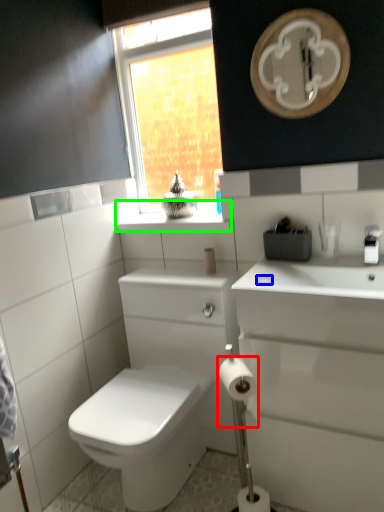
Question: Considering the real-world distances, which object is closest to toilet paper (highlighted by a red box)? soap (highlighted by a blue box) or counter top (highlighted by a green box).

Choices:
 (A) soap
 (B) counter top

Answer: (A)